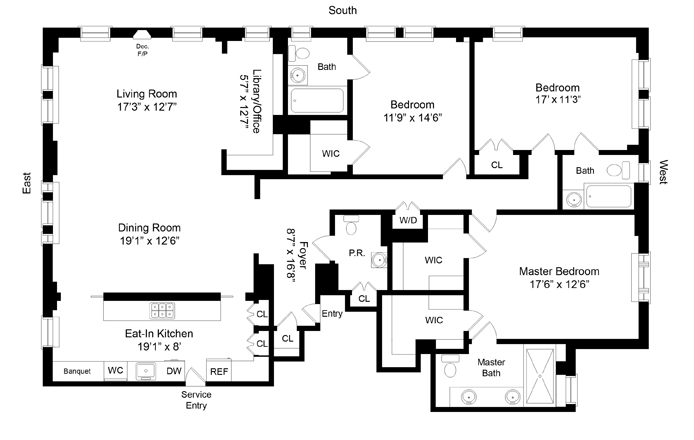
Find the location of a particular element. floor plans is located at coordinates (345, 380).